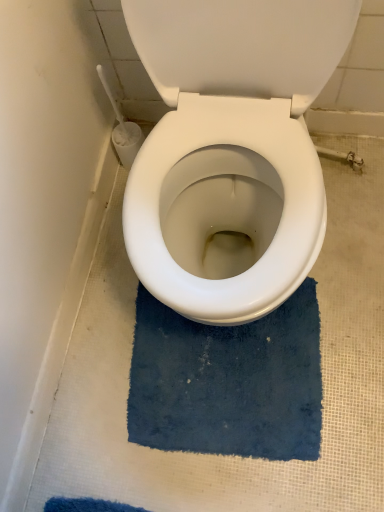
Find the location of `free space to the left of dark blue plush bath mat at center`. free space to the left of dark blue plush bath mat at center is located at coordinates (100, 406).